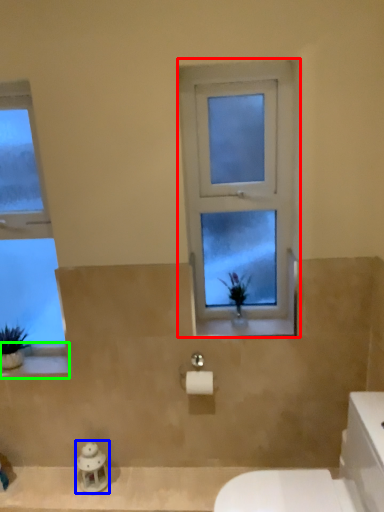
Question: Estimate the real-world distances between objects in this image. Which object is closer to window (highlighted by a red box), figurine (highlighted by a blue box) or window sill (highlighted by a green box)?

Choices:
 (A) figurine
 (B) window sill

Answer: (B)